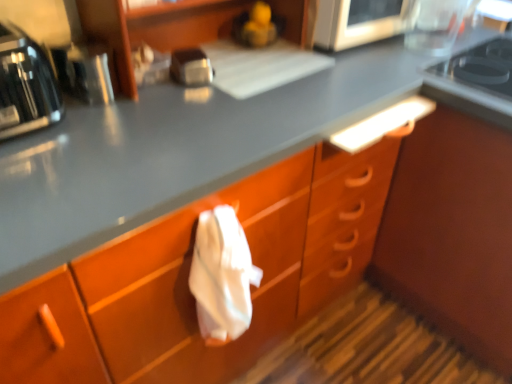
Locate an element on the screen. vacant area that is in front of shiny black toaster at left is located at coordinates (35, 162).